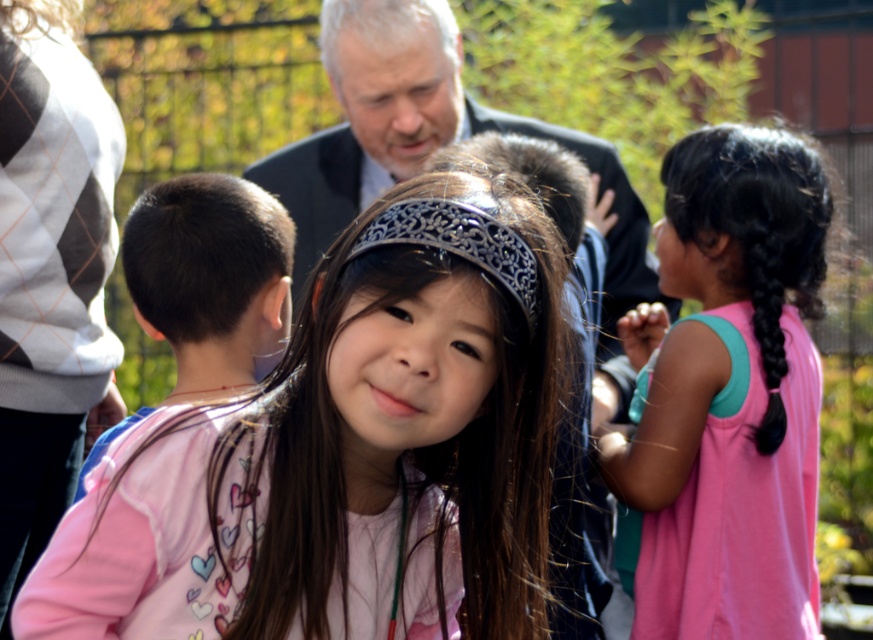
Can you confirm if pink fabric at center is smaller than gray matte hair at upper center?

No, pink fabric at center is not smaller than gray matte hair at upper center.

Between pink fabric at center and gray matte hair at upper center, which one appears on the right side from the viewer's perspective?

pink fabric at center

Is point (363, 545) farther from camera compared to point (409, 32)?

No, it is not.

Where is `pink fabric at center`? Image resolution: width=873 pixels, height=640 pixels. pink fabric at center is located at coordinates (349, 451).

Is pink fabric at center further to the viewer compared to black smooth hair at left?

That is False.

The height and width of the screenshot is (640, 873). Find the location of `pink fabric at center`. pink fabric at center is located at coordinates (349, 451).

Does smooth black suit at center appear over black shiny hair at center?

Indeed, smooth black suit at center is positioned over black shiny hair at center.

Is smooth black suit at center positioned at the back of black shiny hair at center?

That is True.

Does point (286, 198) come farther from viewer compared to point (517, 141)?

Yes, it is behind point (517, 141).

Image resolution: width=873 pixels, height=640 pixels. Find the location of `smooth black suit at center`. smooth black suit at center is located at coordinates (424, 156).